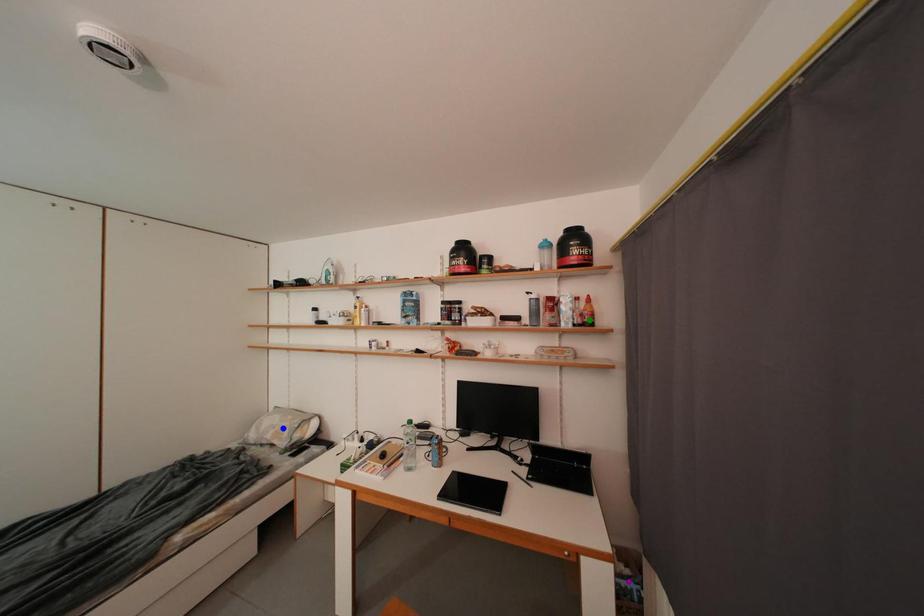
Order these from nearest to farthest:
green point, purple point, blue point

purple point < green point < blue point